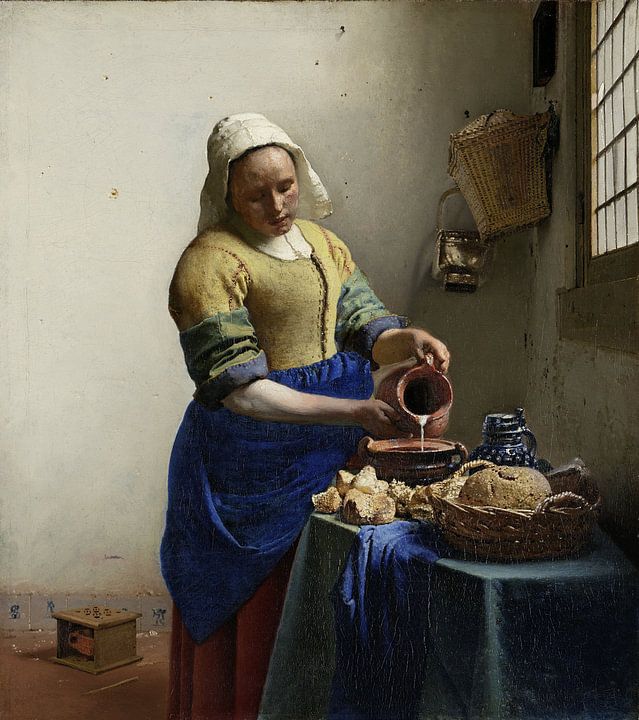
I want to click on foot warmer, so [114, 634].